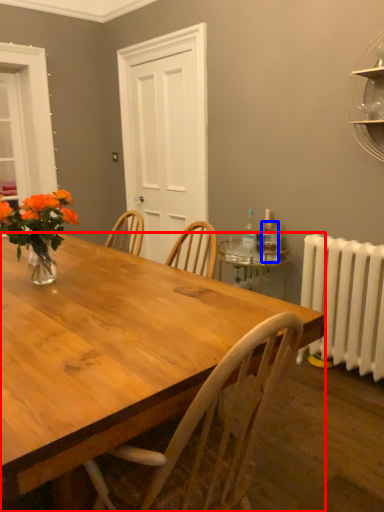
Question: Which point is further to the camera, desk (highlighted by a red box) or bottle (highlighted by a blue box)?

Choices:
 (A) desk
 (B) bottle

Answer: (B)